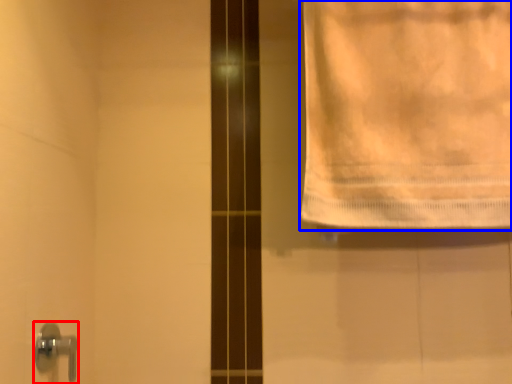
Question: Which object appears farthest to the camera in this image, door handle (highlighted by a red box) or towel (highlighted by a blue box)?

Choices:
 (A) door handle
 (B) towel

Answer: (B)